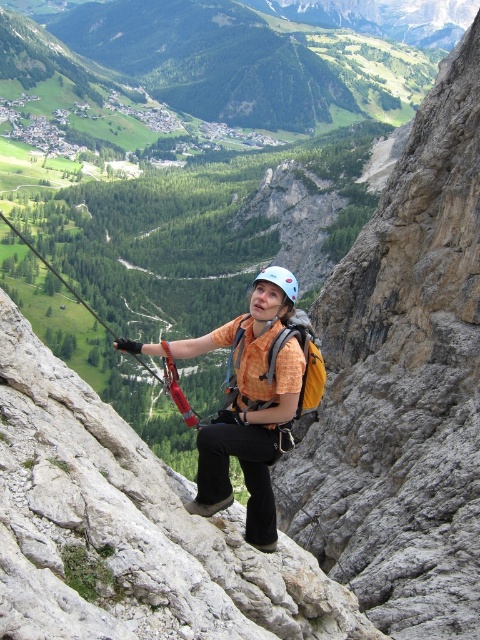
Describe the element at coordinates (173, 388) in the screenshot. I see `red nylon rope at center` at that location.

Does red nylon rope at center appear under light blue matte helmet at center?

Yes, red nylon rope at center is below light blue matte helmet at center.

I want to click on red nylon rope at center, so click(173, 388).

Is point (268, 401) less distant than point (136, 358)?

Yes, it is in front of point (136, 358).

Between orange fabric shirt at center and red nylon rope at center, which one has more height?

With more height is red nylon rope at center.

You are a GUI agent. You are given a task and a screenshot of the screen. Output one action in this format:
    pyautogui.click(x=<x>, y=<y>)
    Task: Click on the orange fabric shirt at center
    
    Given the screenshot: What is the action you would take?
    pyautogui.click(x=252, y=397)

Does orange fabric shirt at center appear under light blue matte helmet at center?

Indeed, orange fabric shirt at center is positioned under light blue matte helmet at center.

Is point (256, 413) closer to camera compared to point (292, 284)?

Yes.

At what (x,y) coordinates should I click in order to perform the action: click on orange fabric shirt at center. Please return your answer as a coordinate pair (x, y). This screenshot has height=640, width=480. Looking at the image, I should click on (252, 397).